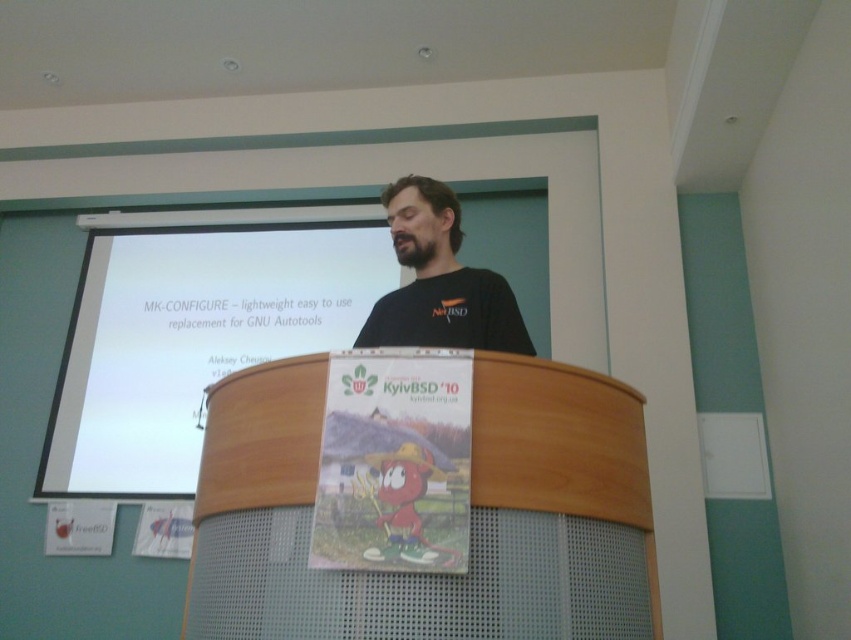
You are standing at the camera position and want to reach the white matte projection screen at upper center. The maximum distance you can walk forward is 10 feet. Can you reach it without moving any objects?

The white matte projection screen at upper center is 10.01 feet away from the camera. Since the maximum distance you can walk forward is 10 feet, you cannot reach it without moving any objects.

You are an event organizer setting up a stage. You have a 1.2 meter wide banner that needs to be placed on either the wooden podium at center or the white matte projection screen at upper center. Based on their widths, which object can accommodate the banner without it hanging over the edges?

The white matte projection screen at upper center has a greater width than the wooden podium at center. Since the banner is 1.2 meters wide, it can be placed on the white matte projection screen at upper center as it is wider and can accommodate the banner without overhang.

You are an attendee at this event and want to take a photo of the presenter. To ensure the black matte shirt at center is fully visible in the photo, should you stand to the right or left of the wooden podium at center?

To ensure the black matte shirt at center is fully visible, you should stand to the left of the wooden podium at center because the wooden podium at center is positioned on the right side of the black matte shirt at center, which would block the view if you stand to the right.